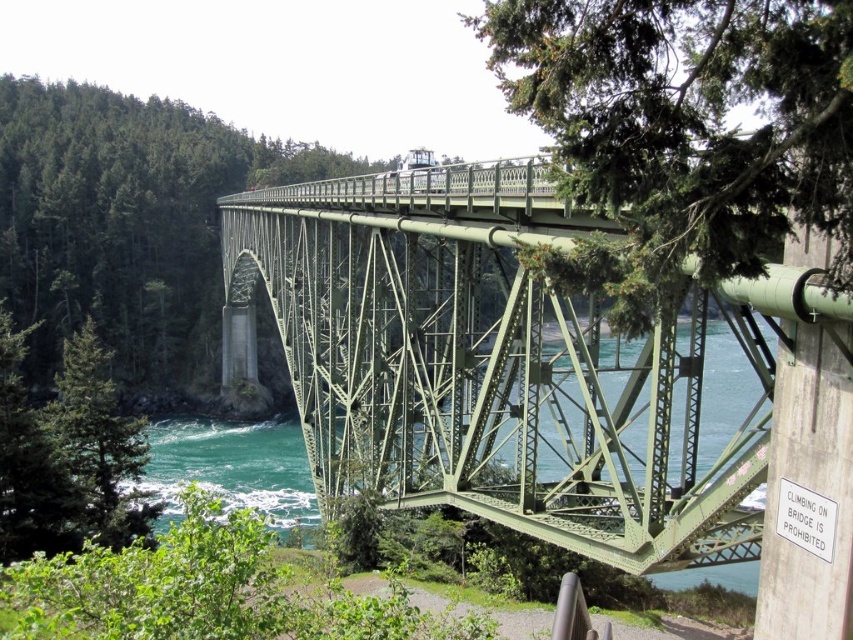
Question: Does green painted steel bridge at center have a greater width compared to green textured tree at upper right?

Choices:
 (A) no
 (B) yes

Answer: (B)

Question: Which is farther from the green textured tree at upper right?

Choices:
 (A) green metal bridge at center
 (B) green painted steel bridge at center

Answer: (A)

Question: Among these objects, which one is farthest from the camera?

Choices:
 (A) green painted steel bridge at center
 (B) green textured tree at upper right
 (C) green textured tree at lower left
 (D) green metal bridge at center

Answer: (D)

Question: Which point is farther from the camera taking this photo?

Choices:
 (A) (102, 388)
 (B) (619, 172)
 (C) (595, 502)

Answer: (A)

Question: Does green textured tree at upper right have a greater width compared to green textured tree at lower left?

Choices:
 (A) no
 (B) yes

Answer: (A)

Question: From the image, what is the correct spatial relationship of green painted steel bridge at center in relation to green textured tree at lower left?

Choices:
 (A) right
 (B) left

Answer: (A)